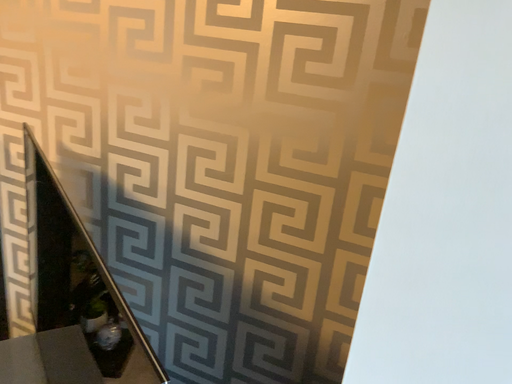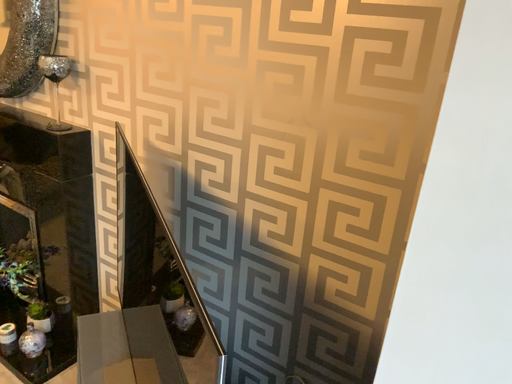
Question: How did the camera likely rotate when shooting the video?

Choices:
 (A) rotated right
 (B) rotated left

Answer: (B)